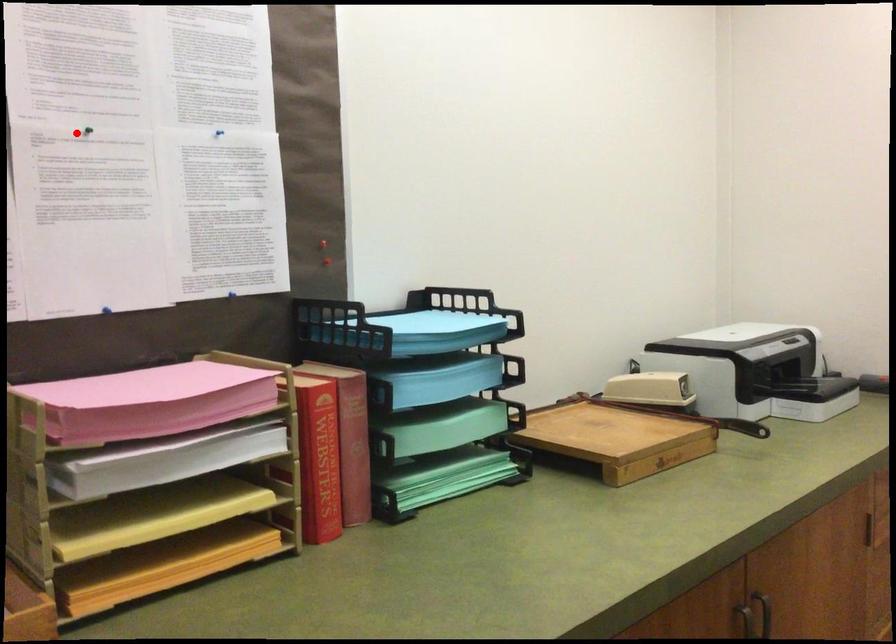
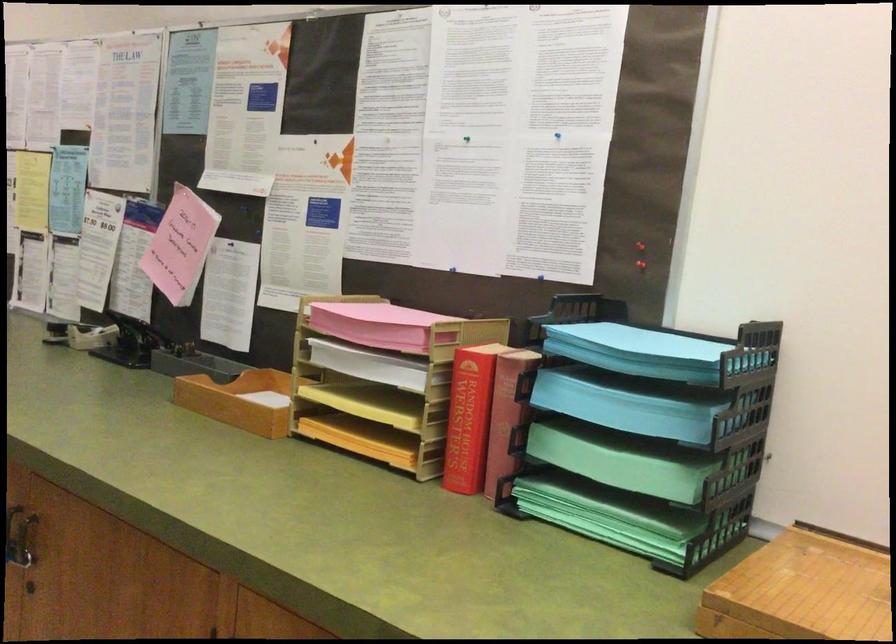
Locate, in the second image, the point that corresponds to the highlighted location in the first image.

(467, 138)